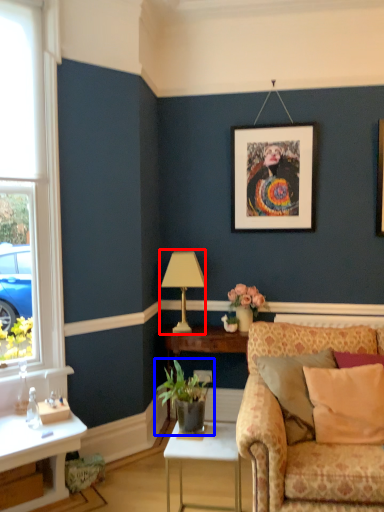
Question: Which object is further to the camera taking this photo, table lamp (highlighted by a red box) or houseplant (highlighted by a blue box)?

Choices:
 (A) table lamp
 (B) houseplant

Answer: (A)